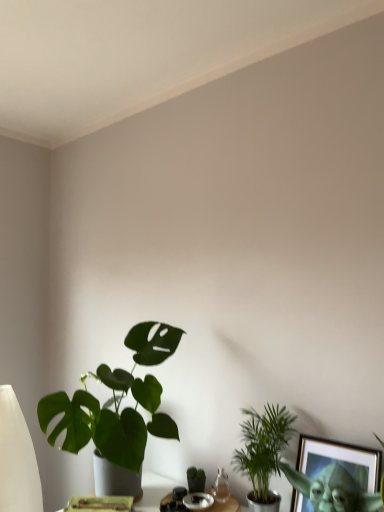
Where is `vacant space to the right of green matte houseplant at center, the 2th houseplant from the right`? Image resolution: width=384 pixels, height=512 pixels. vacant space to the right of green matte houseplant at center, the 2th houseplant from the right is located at coordinates (223, 493).